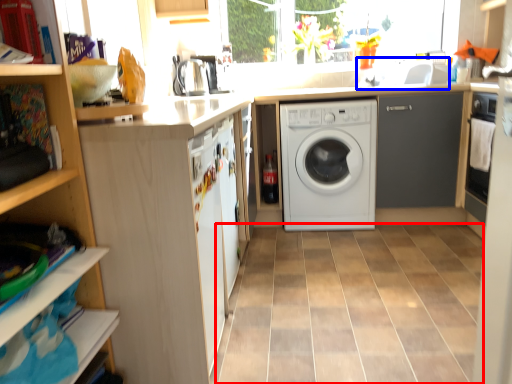
Question: Which of the following is the farthest to the observer, ceramic tile (highlighted by a red box) or sink (highlighted by a blue box)?

Choices:
 (A) ceramic tile
 (B) sink

Answer: (B)